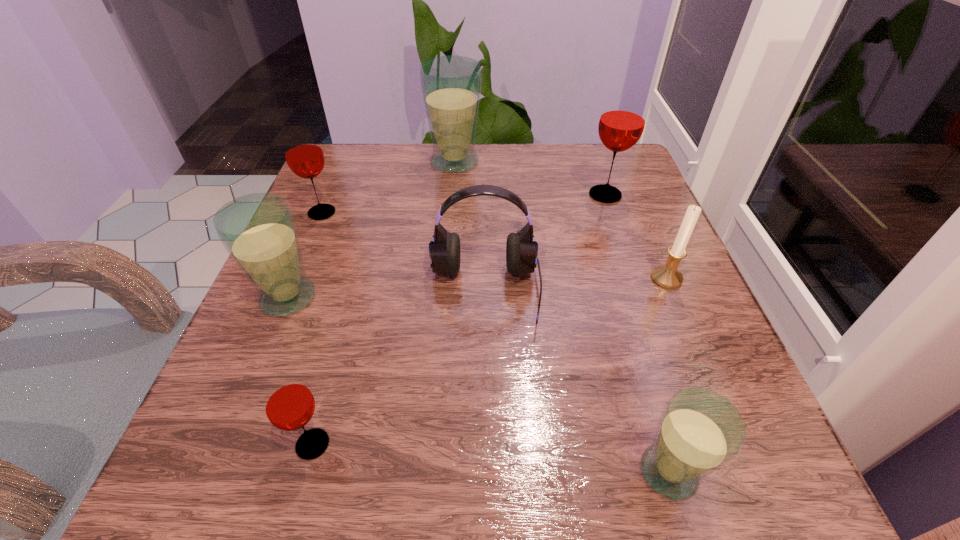
Identify the location of candle holder located at the right edge. (667, 276).

Image resolution: width=960 pixels, height=540 pixels. In order to click on object at the near left corner in this screenshot , I will do `click(289, 405)`.

In order to click on object positioned at the far right corner in this screenshot , I will do `click(623, 117)`.

You are a GUI agent. You are given a task and a screenshot of the screen. Output one action in this format:
    pyautogui.click(x=<x>, y=<y>)
    Task: Click on the object at the near right corner
    This screenshot has height=540, width=960.
    Given the screenshot: What is the action you would take?
    pyautogui.click(x=699, y=431)

Where is `vacant area at the far edge of the desktop`? The width and height of the screenshot is (960, 540). vacant area at the far edge of the desktop is located at coordinates (532, 167).

Locate an element on the screen. This screenshot has width=960, height=540. free space at the near edge of the desktop is located at coordinates (492, 450).

Locate an element on the screen. This screenshot has height=540, width=960. vacant space at the left edge of the desktop is located at coordinates (320, 247).

Where is `free space at the right edge`? free space at the right edge is located at coordinates (692, 289).

Image resolution: width=960 pixels, height=540 pixels. Identify the location of free space at the far left corner of the desktop. (365, 189).

Identify the location of vacant space at the near left corner of the desktop. The height and width of the screenshot is (540, 960). (188, 454).